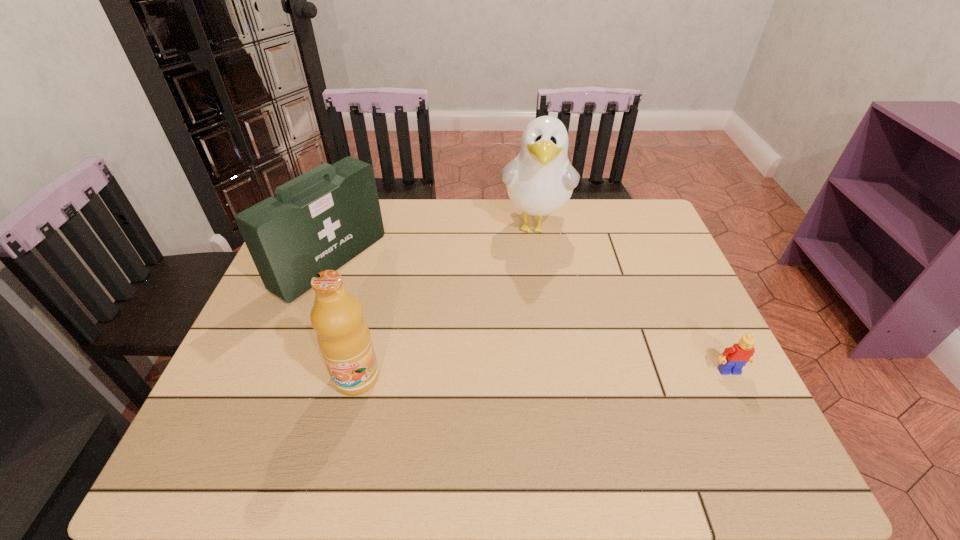
Find the location of a particular element. The width and height of the screenshot is (960, 540). the third closest object to the second object from right to left is located at coordinates (343, 336).

Find the location of a particular element. object that is the third closest to the third object from left to right is located at coordinates (343, 336).